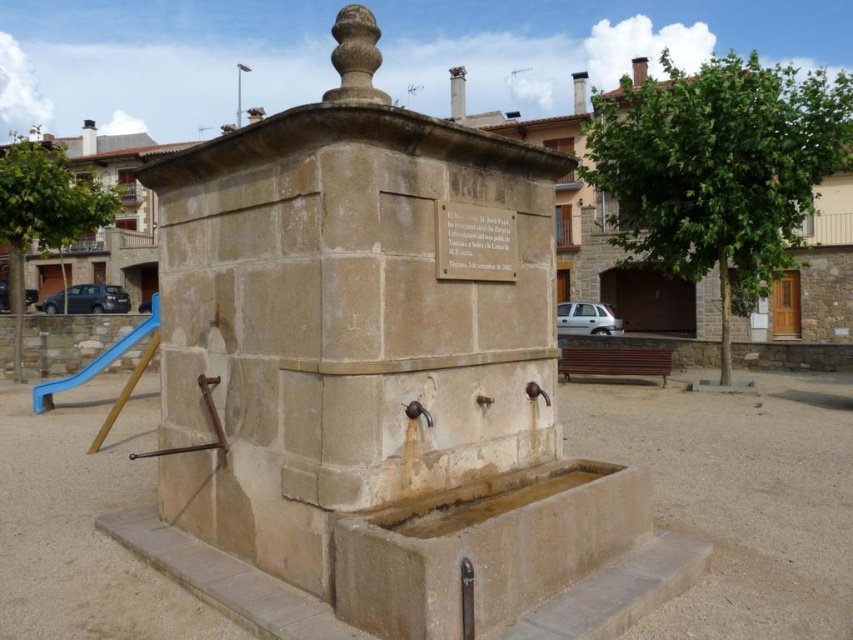
Question: In this image, where is stone plaque at center located relative to blue plastic slide at left?

Choices:
 (A) above
 (B) below

Answer: (A)

Question: Is stone plaque at center positioned behind blue plastic slide at left?

Choices:
 (A) yes
 (B) no

Answer: (B)

Question: Among these objects, which one is nearest to the camera?

Choices:
 (A) blue plastic slide at left
 (B) stone plaque at center

Answer: (B)

Question: Does stone plaque at center have a larger size compared to blue plastic slide at left?

Choices:
 (A) no
 (B) yes

Answer: (A)